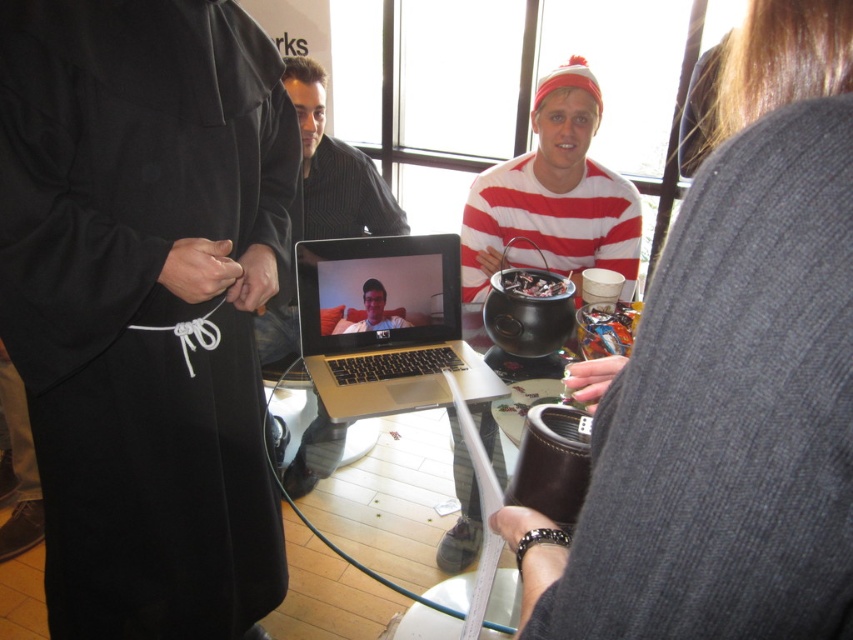
Question: Does gold metallic laptop at center have a smaller size compared to black matte cauldron at center?

Choices:
 (A) yes
 (B) no

Answer: (A)

Question: Considering the real-world distances, which object is farthest from the matte black laptop at center?

Choices:
 (A) gold metallic laptop at center
 (B) black matte cauldron at center
 (C) metallic silver laptop at center
 (D) black matte robe at left

Answer: (C)

Question: Can you confirm if black matte robe at left is bigger than metallic silver laptop at center?

Choices:
 (A) yes
 (B) no

Answer: (A)

Question: Can you confirm if black leather purse at lower right is smaller than gold metallic laptop at center?

Choices:
 (A) no
 (B) yes

Answer: (B)

Question: Which of these objects is positioned farthest from the metallic silver laptop at center?

Choices:
 (A) matte black laptop at center
 (B) black leather purse at lower right
 (C) gold metallic laptop at center

Answer: (B)

Question: Which of the following is the farthest from the observer?

Choices:
 (A) (577, 262)
 (B) (80, 257)
 (C) (427, 337)

Answer: (A)